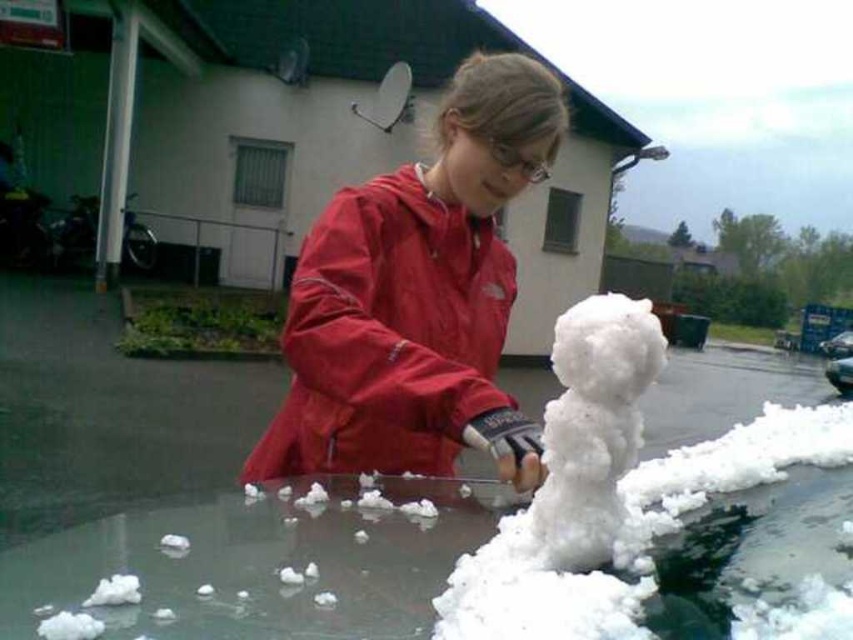
Question: Which object is farther from the camera taking this photo?

Choices:
 (A) matte red jacket at center
 (B) shiny black car at lower right

Answer: (B)

Question: Which object is the farthest from the matte red jacket at center?

Choices:
 (A) white fluffy snowman at center
 (B) shiny black car at lower right

Answer: (B)

Question: Which object is closer to the camera taking this photo?

Choices:
 (A) shiny black car at lower right
 (B) white fluffy snowman at center
 (C) matte red jacket at center

Answer: (B)

Question: Is matte red jacket at center closer to camera compared to white fluffy snowman at center?

Choices:
 (A) yes
 (B) no

Answer: (B)

Question: In this image, where is white fluffy snowman at center located relative to shiny black car at lower right?

Choices:
 (A) left
 (B) right

Answer: (A)

Question: Is the position of matte red jacket at center less distant than that of shiny black car at lower right?

Choices:
 (A) yes
 (B) no

Answer: (A)